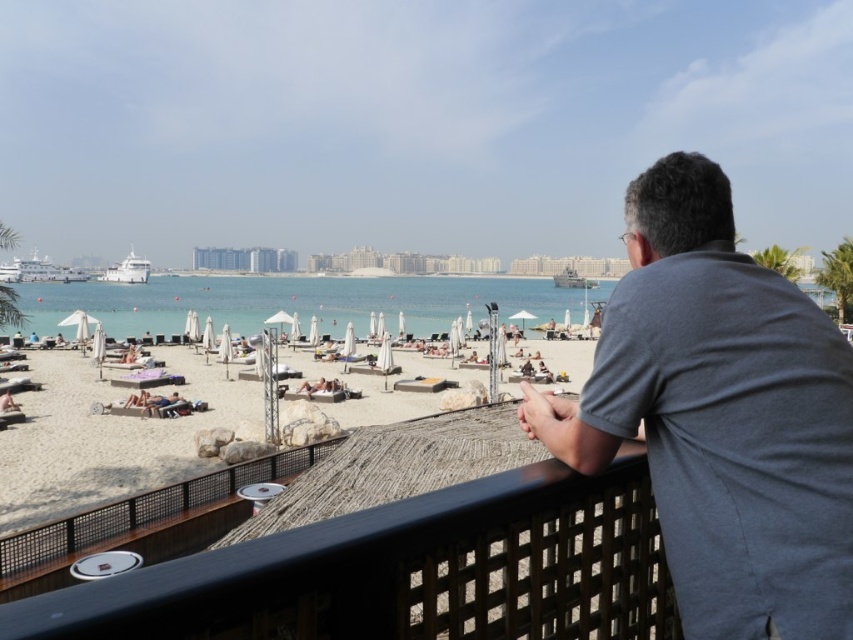
You are standing on the balcony and want to point out the clear blue water at center to a friend. Which direction should you indicate relative to the tan skin person at lower left?

The clear blue water at center is to the left of the tan skin person at lower left.